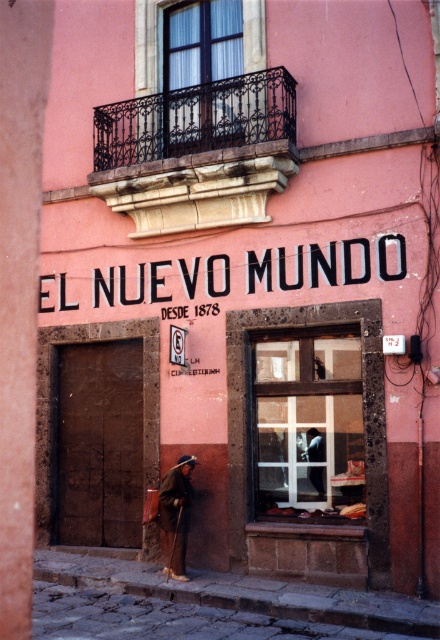
Question: Does brown woolen robe at lower center appear on the right side of white cotton robe at center?

Choices:
 (A) no
 (B) yes

Answer: (A)

Question: Which point is closer to the camera?

Choices:
 (A) (180, 474)
 (B) (316, 452)

Answer: (A)

Question: Can you confirm if brown woolen robe at lower center is positioned below white cotton robe at center?

Choices:
 (A) no
 (B) yes

Answer: (B)

Question: Considering the relative positions of brown woolen robe at lower center and white cotton robe at center in the image provided, where is brown woolen robe at lower center located with respect to white cotton robe at center?

Choices:
 (A) right
 (B) left

Answer: (B)

Question: Which point is farther to the camera?

Choices:
 (A) brown woolen robe at lower center
 (B) white cotton robe at center

Answer: (B)

Question: Among these points, which one is farthest from the camera?

Choices:
 (A) (321, 435)
 (B) (186, 513)

Answer: (A)